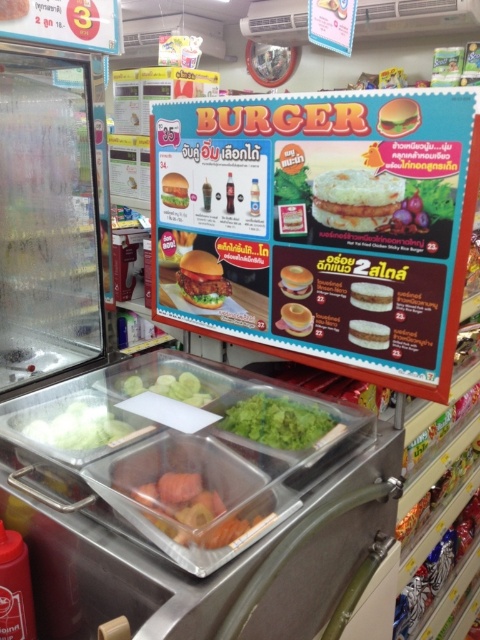
Between white matte hamburger at center and golden crispy hamburger at center, which one is positioned lower?

golden crispy hamburger at center is lower down.

Is white matte hamburger at center wider than golden crispy hamburger at center?

Yes, white matte hamburger at center is wider than golden crispy hamburger at center.

Is point (368, 288) closer to viewer compared to point (288, 330)?

Yes, it is in front of point (288, 330).

Image resolution: width=480 pixels, height=640 pixels. In order to click on white matte hamburger at center in this screenshot , I will do `click(371, 296)`.

Is point (113, 416) positioned in front of point (359, 294)?

No, it is not.

Is green matte lettuce at center to the right of white matte hamburger at center from the viewer's perspective?

No, green matte lettuce at center is not to the right of white matte hamburger at center.

Between point (99, 424) and point (358, 291), which one is positioned in front?

Point (99, 424) is in front.

Locate an element on the screen. This screenshot has height=640, width=480. green matte lettuce at center is located at coordinates (79, 428).

Does matte plastic burger menu at upper center have a smaller size compared to golden brown beef patty at center?

No.

Between matte plastic burger menu at upper center and golden brown beef patty at center, which one has less height?

golden brown beef patty at center

Image resolution: width=480 pixels, height=640 pixels. Identify the location of matte plastic burger menu at upper center. (323, 225).

The image size is (480, 640). Identify the location of matte plastic burger menu at upper center. (323, 225).